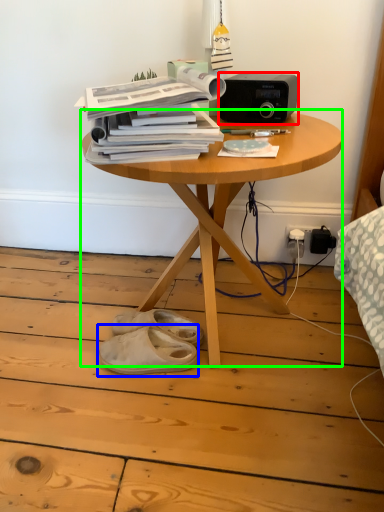
Question: Which object is the closest to the stereo (highlighted by a red box)? Choose among these: footwear (highlighted by a blue box) or table (highlighted by a green box).

Choices:
 (A) footwear
 (B) table

Answer: (B)